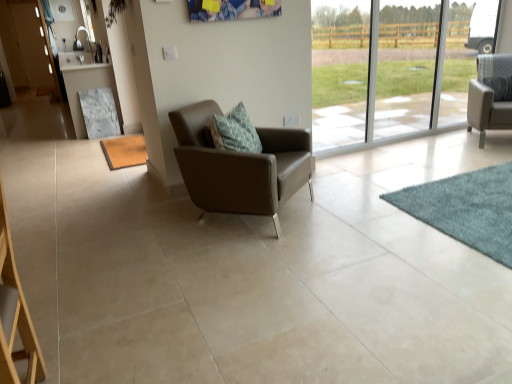
Question: Can you confirm if marble table at left is taller than matte wood screen door at upper left?

Choices:
 (A) no
 (B) yes

Answer: (A)

Question: Is marble table at left to the right of matte wood screen door at upper left from the viewer's perspective?

Choices:
 (A) yes
 (B) no

Answer: (A)

Question: Can you confirm if marble table at left is positioned to the left of matte wood screen door at upper left?

Choices:
 (A) yes
 (B) no

Answer: (B)

Question: Is matte wood screen door at upper left at the back of marble table at left?

Choices:
 (A) yes
 (B) no

Answer: (B)

Question: Are marble table at left and matte wood screen door at upper left beside each other?

Choices:
 (A) yes
 (B) no

Answer: (B)

Question: Is teal carpet at lower right, which ranks as the first mat in right-to-left order, to the left or to the right of brown textured mat at lower left, the 2th mat ordered from the bottom, in the image?

Choices:
 (A) right
 (B) left

Answer: (A)

Question: Is point (505, 243) positioned closer to the camera than point (132, 163)?

Choices:
 (A) farther
 (B) closer

Answer: (B)

Question: Is teal carpet at lower right, the second mat when ordered from top to bottom, taller or shorter than brown textured mat at lower left, arranged as the 1th mat when viewed from the back?

Choices:
 (A) tall
 (B) short

Answer: (A)

Question: From the image's perspective, is teal carpet at lower right, which is the first mat from bottom to top, above or below brown textured mat at lower left, arranged as the 2th mat when viewed from the right?

Choices:
 (A) above
 (B) below

Answer: (B)

Question: From a real-world perspective, relative to marble table at left, is matte wood screen door at upper left vertically above or below?

Choices:
 (A) below
 (B) above

Answer: (B)

Question: Is matte wood screen door at upper left inside or outside of marble table at left?

Choices:
 (A) outside
 (B) inside

Answer: (A)

Question: Is matte wood screen door at upper left taller or shorter than marble table at left?

Choices:
 (A) tall
 (B) short

Answer: (A)

Question: Considering the positions of point (15, 23) and point (73, 102), is point (15, 23) closer or farther from the camera than point (73, 102)?

Choices:
 (A) farther
 (B) closer

Answer: (A)

Question: Is point (26, 56) closer or farther from the camera than point (221, 180)?

Choices:
 (A) closer
 (B) farther

Answer: (B)

Question: Visually, is matte wood screen door at upper left positioned to the left or to the right of brown leather armchair at center, the second chair viewed from the right?

Choices:
 (A) left
 (B) right

Answer: (A)